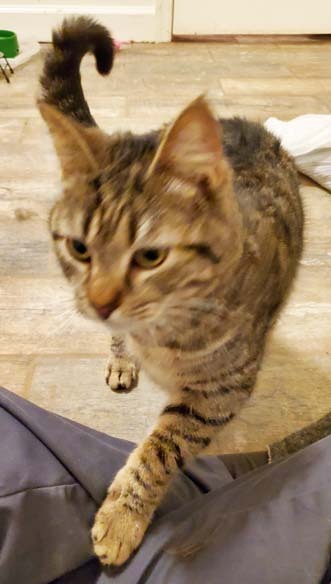
Locate an element on the screen. The width and height of the screenshot is (331, 584). floor under cat is located at coordinates [148, 391].